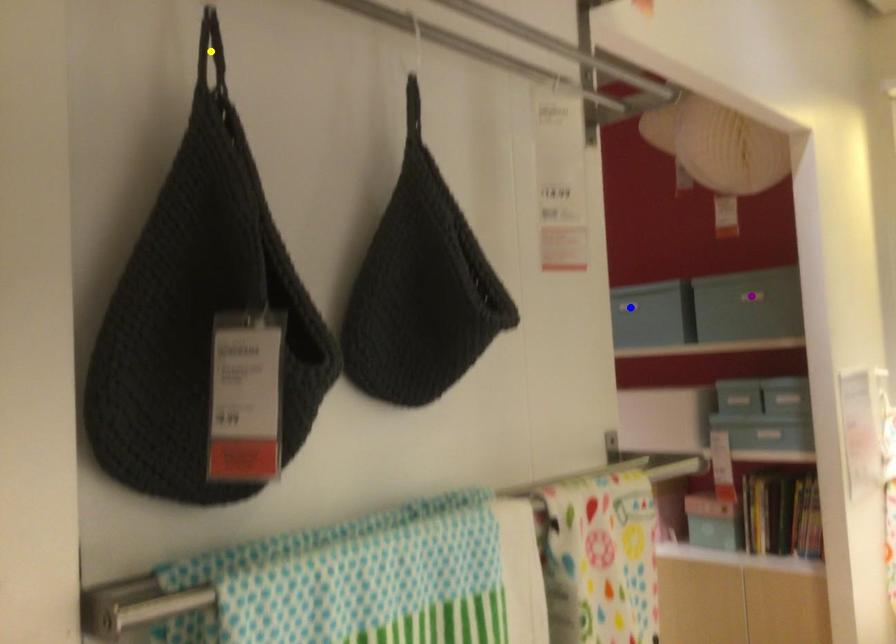
Order these from farthest to nearest:
1. blue point
2. yellow point
3. purple point

blue point
purple point
yellow point